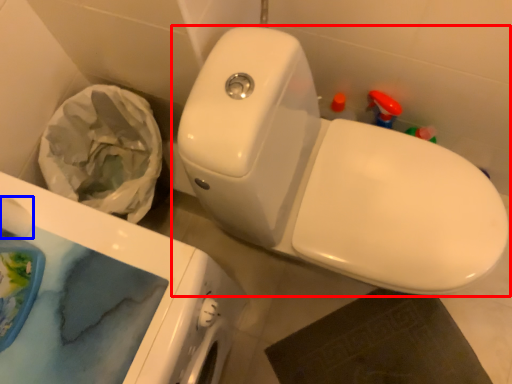
Question: Which of the following is the farthest to the observer, toilet (highlighted by a red box) or toilet paper (highlighted by a blue box)?

Choices:
 (A) toilet
 (B) toilet paper

Answer: (B)